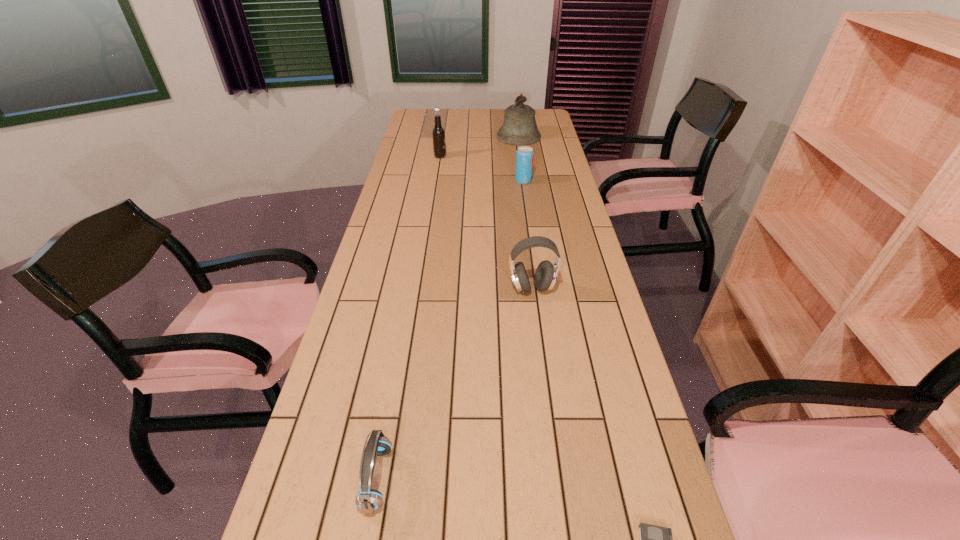
This screenshot has width=960, height=540. In order to click on free spot between the nearer headset and the second farthest object in this screenshot , I will do 408,318.

Locate an element on the screen. Image resolution: width=960 pixels, height=540 pixels. free spot between the soda can and the taller headset is located at coordinates pos(528,234).

This screenshot has width=960, height=540. In order to click on empty space that is in between the farthest object and the farther headset in this screenshot , I will do `click(525, 212)`.

Where is `blank region between the bell and the right headset`? blank region between the bell and the right headset is located at coordinates (525, 212).

I want to click on free spot between the root beer and the right headset, so click(486, 222).

Find the location of a particular element. blank region between the left headset and the bell is located at coordinates (447, 307).

Identify which object is the fourth closest to the bell. Please provide its 2D coordinates. Your answer should be formatted as a tuple, i.e. [(x, y)], where the tuple contains the x and y coordinates of a point satisfying the conditions above.

[(369, 500)]

Identify which object is the second nearest to the shortest object. Please provide its 2D coordinates. Your answer should be formatted as a tuple, i.e. [(x, y)], where the tuple contains the x and y coordinates of a point satisfying the conditions above.

[(546, 273)]

Locate an element on the screen. The width and height of the screenshot is (960, 540). vacant space that satisfies the following two spatial constraints: 1. on the back side of the soda can; 2. on the label of the second farthest object is located at coordinates (519, 157).

What are the coordinates of `vacant space that satisfies the following two spatial constraints: 1. on the label of the root beer; 2. on the right side of the third shortest object` in the screenshot? It's located at (437, 180).